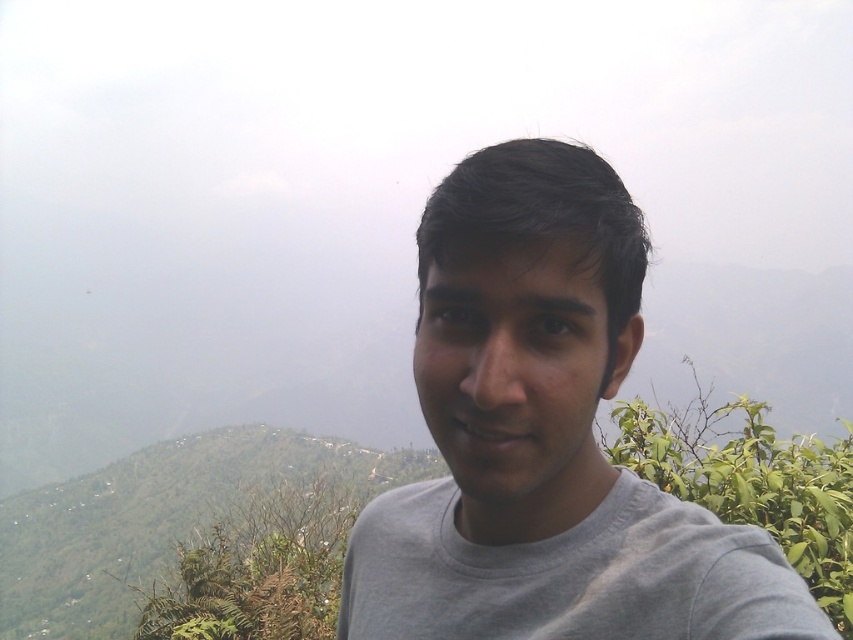
Is the position of gray cotton t-shirt at center less distant than that of green leafy bush at right?

Yes, gray cotton t-shirt at center is in front of green leafy bush at right.

Is point (553, 570) farther from viewer compared to point (804, 477)?

That is False.

You are a GUI agent. You are given a task and a screenshot of the screen. Output one action in this format:
    pyautogui.click(x=<x>, y=<y>)
    Task: Click on the gray cotton t-shirt at center
    Image resolution: width=853 pixels, height=640 pixels.
    Given the screenshot: What is the action you would take?
    pyautogui.click(x=570, y=573)

Which of these two, gray cotton shirt at center or green leafy bush at right, stands taller?

gray cotton shirt at center is taller.

Is point (695, 584) farther from camera compared to point (799, 576)?

No, it is in front of (799, 576).

Locate an element on the screen. This screenshot has width=853, height=640. gray cotton shirt at center is located at coordinates (544, 436).

Is point (796, 600) positioned in front of point (636, 637)?

Yes.

Where is `gray cotton shirt at center`? This screenshot has width=853, height=640. gray cotton shirt at center is located at coordinates (544, 436).